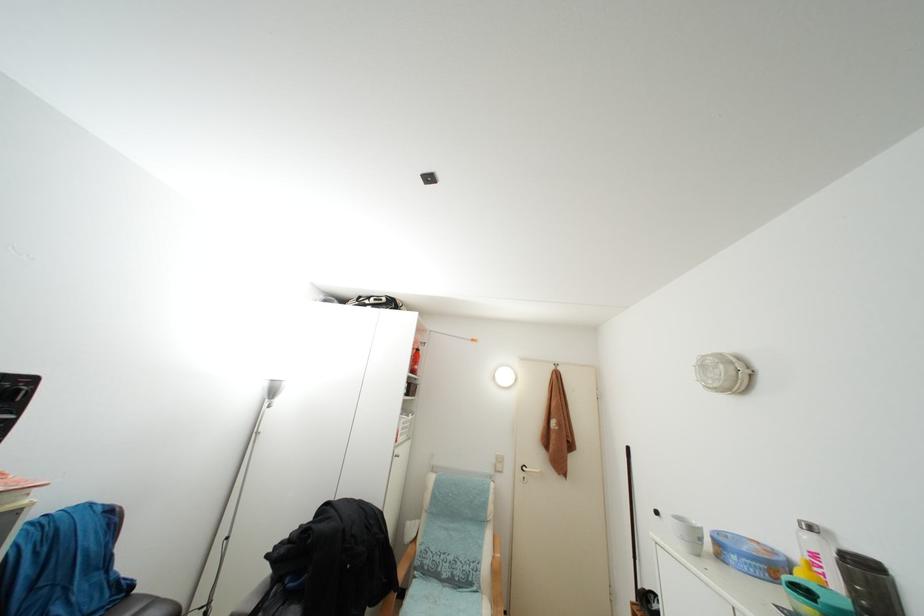
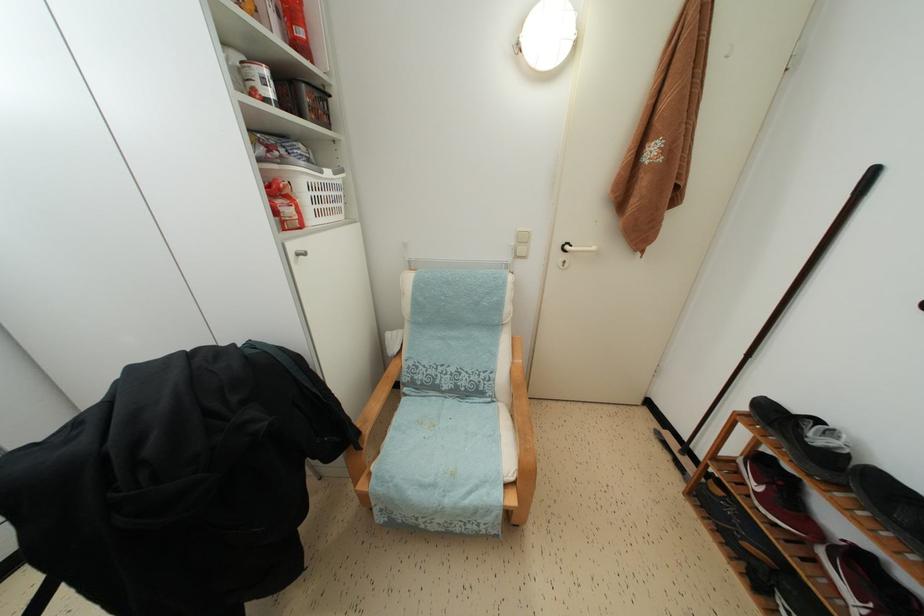
Locate, in the second image, the point that corresponds to (x=504, y=466) in the first image.

(527, 245)